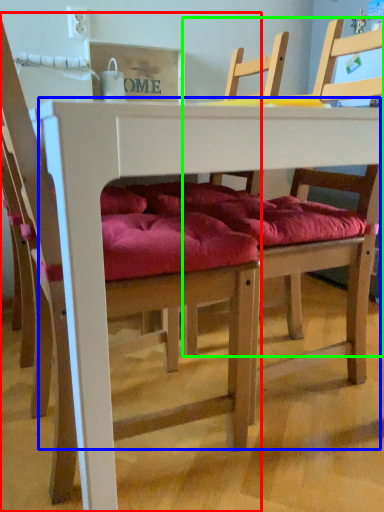
Question: Considering the real-world distances, which object is closest to chair (highlighted by a red box)? table (highlighted by a blue box) or chair (highlighted by a green box).

Choices:
 (A) table
 (B) chair

Answer: (A)